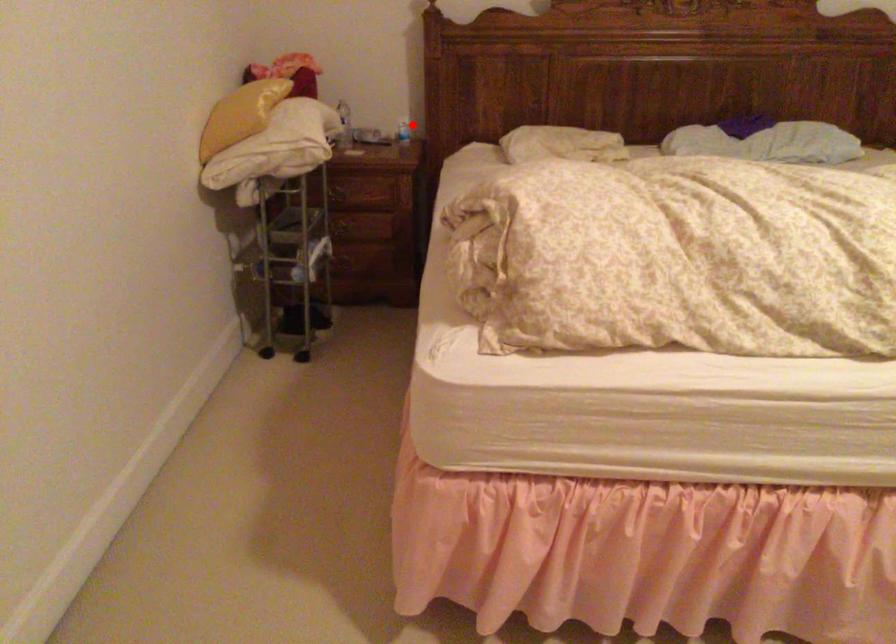
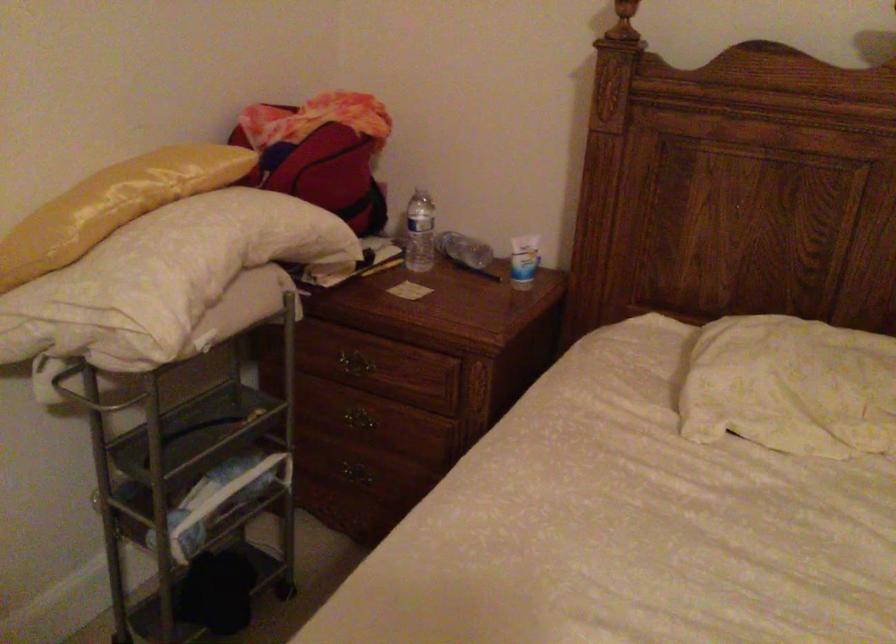
Question: I am providing you with two images of the same scene from different viewpoints. Given a red point in image1, look at the same physical point in image2. Is it:

Choices:
 (A) Closer to the viewpoint
 (B) Farther from the viewpoint

Answer: (A)